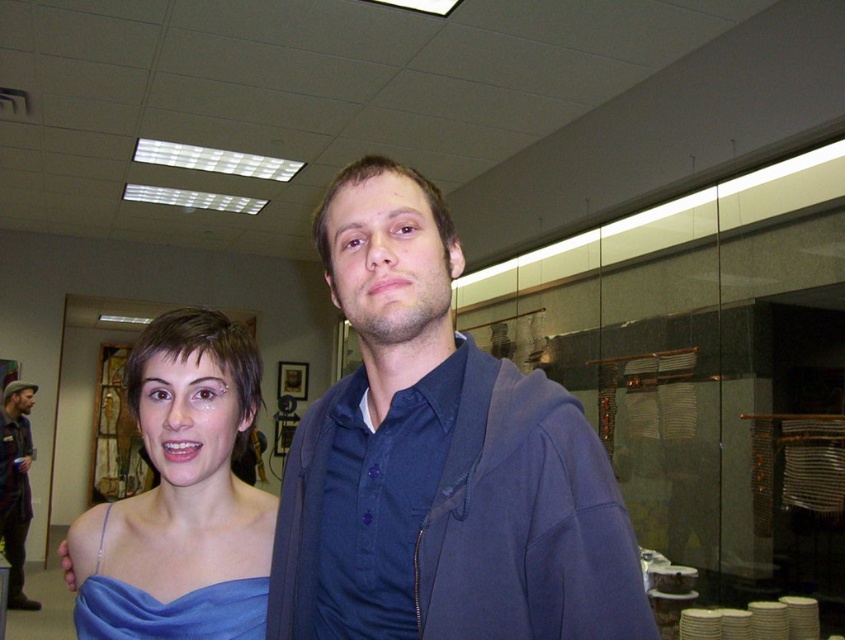
Based on the scene description, where is the satin blue dress at center located in the image?

The satin blue dress at center is located at point (x=181, y=497).

You are a photographer setting up for a photoshoot and notice the satin blue dress at center and the brown leather jacket at left in the frame. Which item is located more to the right side of the frame?

The satin blue dress at center is positioned on the right side of the brown leather jacket at left, so it is more to the right in the frame.

You are organizing a fashion show and need to decide which blue satin dress to place in the front row for a closeup. The blue satin dress at left and the blue satin dress at center are both available. Based on their sizes, which one would you choose for the front row to ensure it stands out more?

The blue satin dress at left is bigger than the blue satin dress at center, so the blue satin dress at left would be better for the front row to ensure it stands out more.